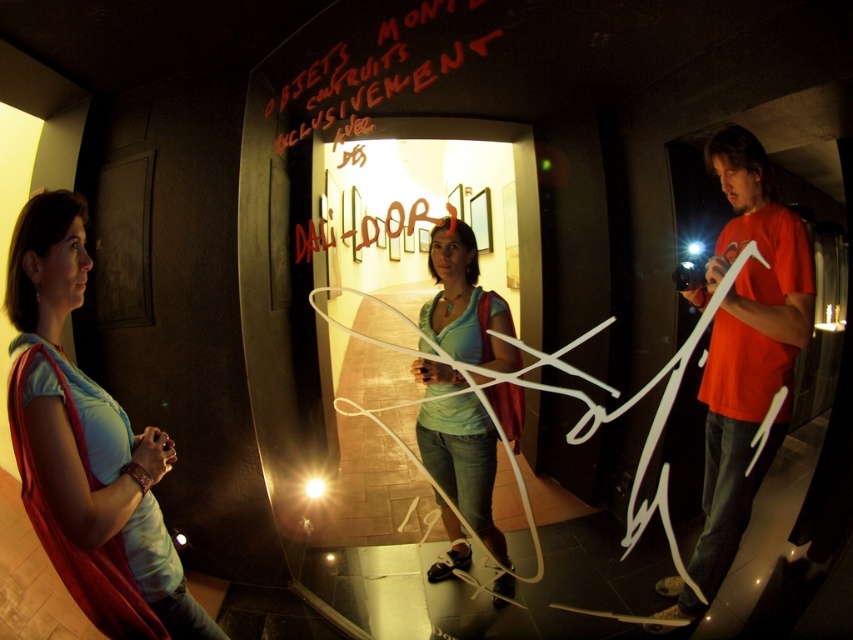
You are an art curator preparing to hang two pieces in the gallery. The blue fabric scarf at left and the matte teal shirt at center need to be positioned so that they are exactly 20 inches apart. Based on the current arrangement, will they fit the requirement?

The blue fabric scarf at left is 20.35 inches from the matte teal shirt at center, which is slightly more than 20 inches. Therefore, they currently meet the requirement as they are just over the required distance.